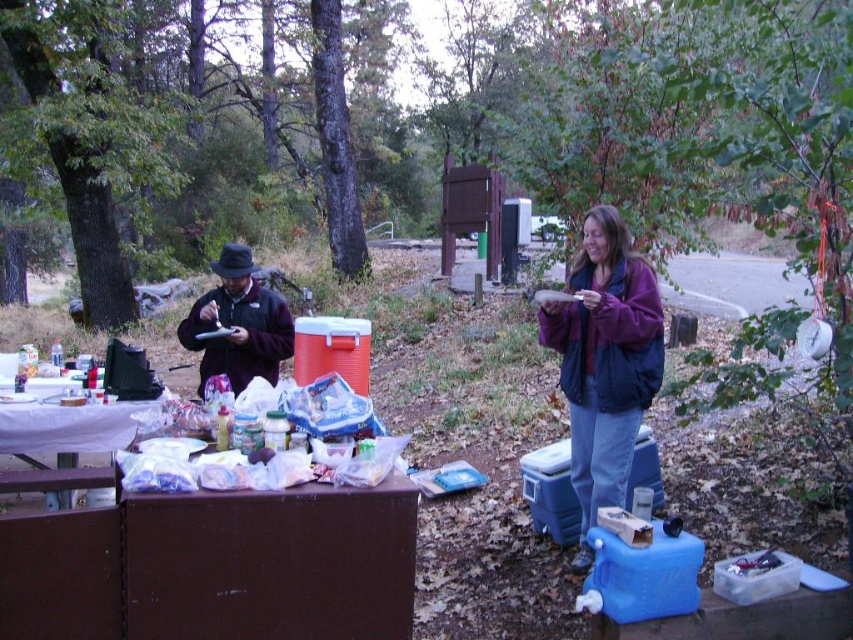
You are standing at the point marked by the coordinate (604, 362) in the image. What object is located at this coordinate?

The purple fleece jacket at upper right is located at the coordinate (604, 362).

You are a hiker who needs to retrieve your water bottle from the brown wood picnic table at lower left. You are currently standing next to the purple fleece jacket at upper right. Can you reach the table without walking more than 3 meters?

The distance between the purple fleece jacket at upper right and the brown wood picnic table at lower left is 2.62 meters, which is less than 3 meters. Therefore, you can reach the table without walking more than 3 meters.